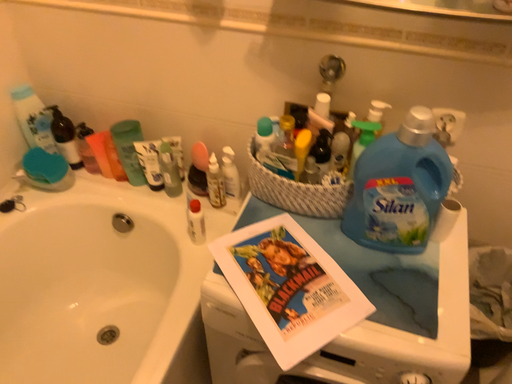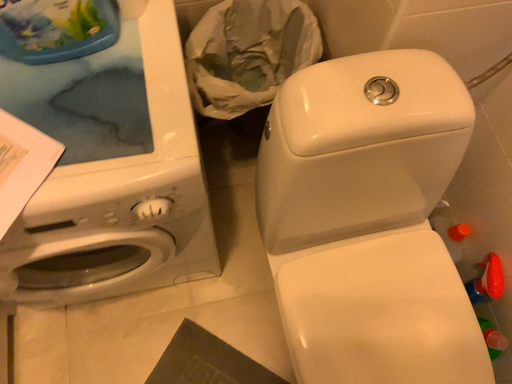
Question: How did the camera likely rotate when shooting the video?

Choices:
 (A) rotated downward
 (B) rotated upward

Answer: (A)